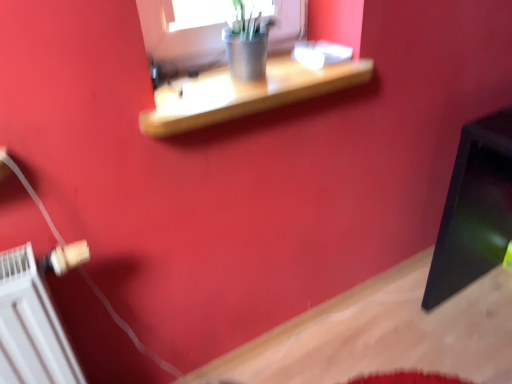
Question: Considering the positions of point pyautogui.click(x=20, y=319) and point pyautogui.click(x=334, y=89), is point pyautogui.click(x=20, y=319) closer or farther from the camera than point pyautogui.click(x=334, y=89)?

Choices:
 (A) farther
 (B) closer

Answer: (B)

Question: From their relative heights in the image, would you say white plastic radiator at lower left is taller or shorter than wooden shelf at upper center?

Choices:
 (A) short
 (B) tall

Answer: (B)

Question: Which is correct: white plastic radiator at lower left is inside wooden shelf at upper center, or outside of it?

Choices:
 (A) outside
 (B) inside

Answer: (A)

Question: From the image's perspective, is wooden shelf at upper center above or below white plastic radiator at lower left?

Choices:
 (A) above
 (B) below

Answer: (A)

Question: In terms of width, does wooden shelf at upper center look wider or thinner when compared to white plastic radiator at lower left?

Choices:
 (A) thin
 (B) wide

Answer: (B)

Question: Is point (263, 107) positioned closer to the camera than point (69, 347)?

Choices:
 (A) closer
 (B) farther

Answer: (B)

Question: Would you say wooden shelf at upper center is inside or outside white plastic radiator at lower left?

Choices:
 (A) inside
 (B) outside

Answer: (B)